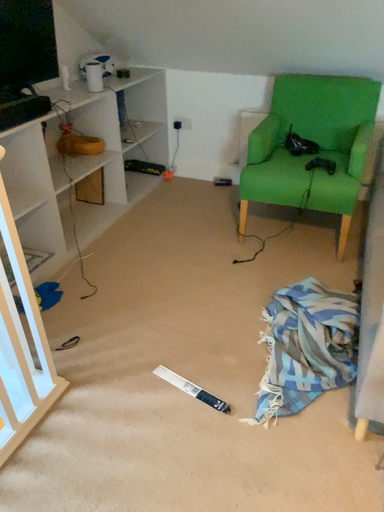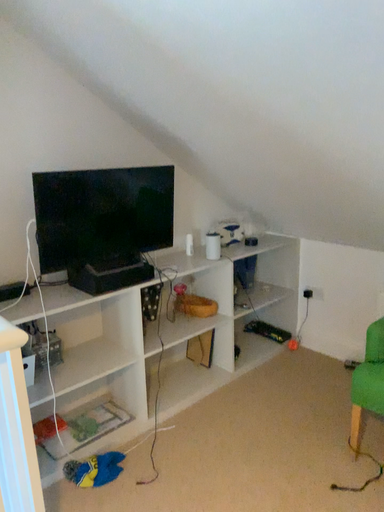
Question: How did the camera likely rotate when shooting the video?

Choices:
 (A) rotated right
 (B) rotated left

Answer: (B)